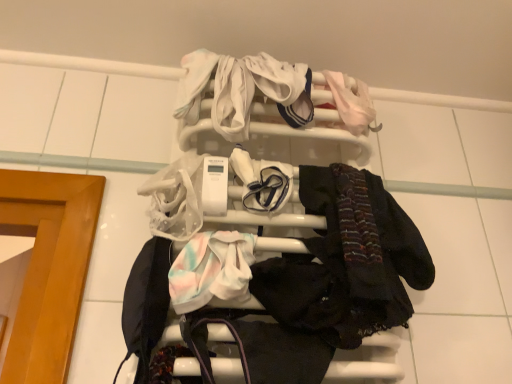
Question: Is white soft fabric at center, the 2th baby clothe when ordered from left to right, bigger than white plastic towel rack at upper center?

Choices:
 (A) no
 (B) yes

Answer: (A)

Question: Considering the relative sizes of white soft fabric at center, the second baby clothe in the back-to-front sequence, and white plastic towel rack at upper center in the image provided, is white soft fabric at center, the second baby clothe in the back-to-front sequence, wider than white plastic towel rack at upper center?

Choices:
 (A) no
 (B) yes

Answer: (A)

Question: Does white soft fabric at center, acting as the 2th baby clothe starting from the right, lie in front of white plastic towel rack at upper center?

Choices:
 (A) no
 (B) yes

Answer: (A)

Question: From the image's perspective, is white soft fabric at center, which appears as the second baby clothe when viewed from the front, above white plastic towel rack at upper center?

Choices:
 (A) yes
 (B) no

Answer: (A)

Question: Considering the relative positions of white soft fabric at center, which appears as the second baby clothe when viewed from the front, and white plastic towel rack at upper center in the image provided, is white soft fabric at center, which appears as the second baby clothe when viewed from the front, to the left of white plastic towel rack at upper center from the viewer's perspective?

Choices:
 (A) no
 (B) yes

Answer: (B)

Question: Considering the positions of pale pink fabric at upper right, the 3th baby clothe when ordered from front to back, and white plastic towel rack at upper center in the image, is pale pink fabric at upper right, the 3th baby clothe when ordered from front to back, taller or shorter than white plastic towel rack at upper center?

Choices:
 (A) short
 (B) tall

Answer: (A)

Question: From a real-world perspective, relative to white plastic towel rack at upper center, is pale pink fabric at upper right, which appears as the third baby clothe when ordered from the bottom, vertically above or below?

Choices:
 (A) above
 (B) below

Answer: (A)

Question: Considering the positions of pale pink fabric at upper right, the 1th baby clothe in the top-to-bottom sequence, and white plastic towel rack at upper center in the image, is pale pink fabric at upper right, the 1th baby clothe in the top-to-bottom sequence, wider or thinner than white plastic towel rack at upper center?

Choices:
 (A) thin
 (B) wide

Answer: (A)

Question: Considering the relative positions of pale pink fabric at upper right, the first baby clothe in the right-to-left sequence, and white plastic towel rack at upper center in the image provided, is pale pink fabric at upper right, the first baby clothe in the right-to-left sequence, to the left or to the right of white plastic towel rack at upper center?

Choices:
 (A) left
 (B) right

Answer: (B)

Question: In terms of height, does pastel tie-dye fabric at center, the 1th baby clothe from the front, look taller or shorter compared to dark matte scarf at center right?

Choices:
 (A) short
 (B) tall

Answer: (A)

Question: From the image's perspective, is pastel tie-dye fabric at center, positioned as the third baby clothe in back-to-front order, above or below dark matte scarf at center right?

Choices:
 (A) above
 (B) below

Answer: (B)

Question: Based on their positions, is pastel tie-dye fabric at center, the 3th baby clothe viewed from the top, located to the left or right of dark matte scarf at center right?

Choices:
 (A) left
 (B) right

Answer: (A)

Question: In the image, is pastel tie-dye fabric at center, marked as the first baby clothe in a bottom-to-top arrangement, positioned in front of or behind dark matte scarf at center right?

Choices:
 (A) behind
 (B) front

Answer: (B)

Question: In the image, is dark matte scarf at center right positioned in front of or behind white soft fabric at center, acting as the 2th baby clothe starting from the right?

Choices:
 (A) behind
 (B) front

Answer: (B)

Question: Does point (346, 291) appear closer or farther from the camera than point (285, 165)?

Choices:
 (A) farther
 (B) closer

Answer: (B)